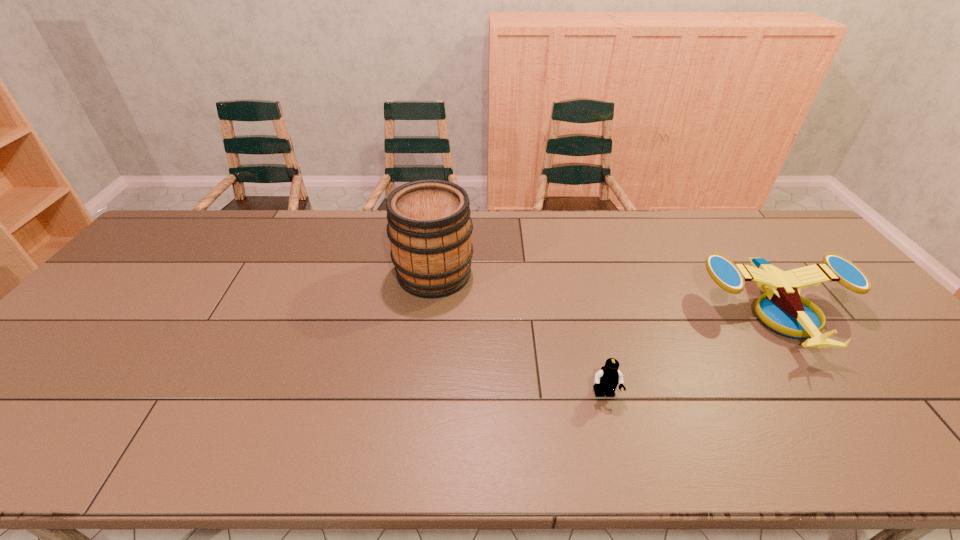
In order to click on the tallest object in this screenshot , I will do `click(429, 226)`.

The image size is (960, 540). Identify the location of the leftmost object. (429, 226).

Locate an element on the screen. the rightmost object is located at coordinates (783, 310).

This screenshot has height=540, width=960. Find the location of `Lego`. Lego is located at coordinates (608, 377).

Locate an element on the screen. the nearest object is located at coordinates (608, 377).

The image size is (960, 540). What are the coordinates of `vacant region located 0.100m on the back of the cider` in the screenshot? It's located at (439, 232).

Where is `vacant space located 0.140m at the cockpit of the rightmost object`? Image resolution: width=960 pixels, height=540 pixels. vacant space located 0.140m at the cockpit of the rightmost object is located at coordinates coord(851,416).

Locate an element on the screen. free space located on the front-facing side of the Lego is located at coordinates (621, 463).

I want to click on object present at the far edge, so click(x=429, y=226).

I want to click on object at the right edge, so click(783, 310).